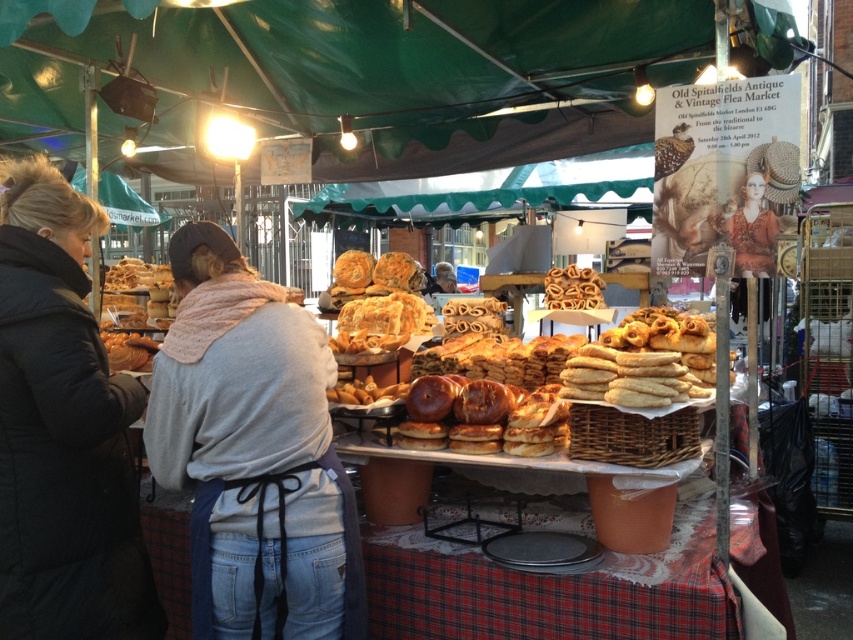
Question: From the image, what is the correct spatial relationship of light gray fleece jacket at center in relation to black puffy jacket at left?

Choices:
 (A) left
 (B) right

Answer: (B)

Question: Is black puffy jacket at left further to camera compared to golden brown doughnut at center?

Choices:
 (A) no
 (B) yes

Answer: (A)

Question: Which of the following is the closest to the observer?

Choices:
 (A) (299, 500)
 (B) (525, 512)
 (C) (108, 284)
 (D) (44, 392)

Answer: (D)

Question: Does black puffy jacket at left lie behind red plaid fabric at center?

Choices:
 (A) yes
 (B) no

Answer: (B)

Question: Which of the following is the farthest from the observer?

Choices:
 (A) black puffy jacket at left
 (B) golden brown bread at left
 (C) golden brown doughnut at center

Answer: (C)

Question: Which of the following is the closest to the observer?

Choices:
 (A) (593, 588)
 (B) (61, 380)
 (C) (381, 268)

Answer: (B)